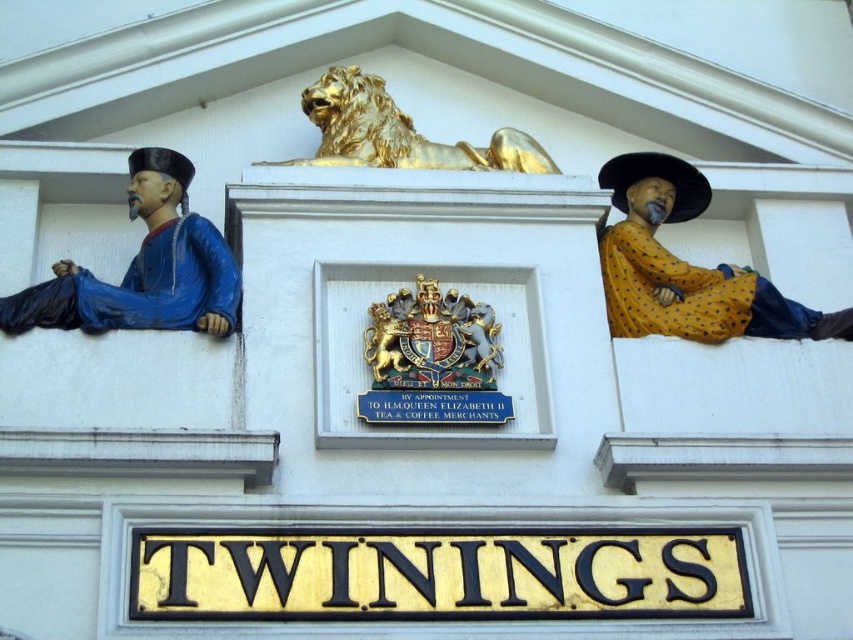
You are an architect analyzing the building facade. From your viewpoint, which object is closer to you between the gold metallic coat of arms at center and the yellow dotted fabric at right?

The yellow dotted fabric at right is closer to you because the gold metallic coat of arms at center is behind it.

You are an architect examining the building facade. You notice the yellow dotted fabric at right and the gold metallic coat of arms at center. Which of these two elements has a larger size?

The yellow dotted fabric at right is bigger than the gold metallic coat of arms at center.